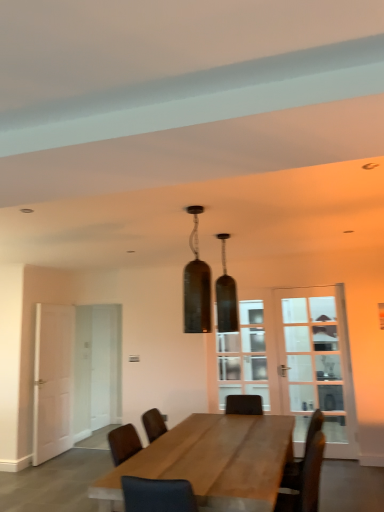
Locate an element on the screen. free spot below matte glass pendant light at center, arranged as the first lamp when viewed from the front (from a real-world perspective) is located at coordinates (212, 452).